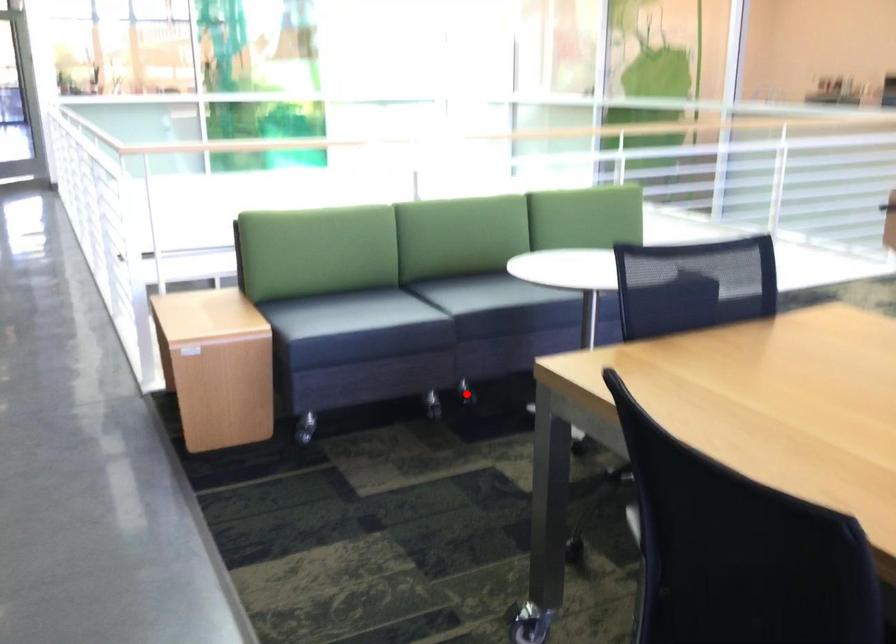
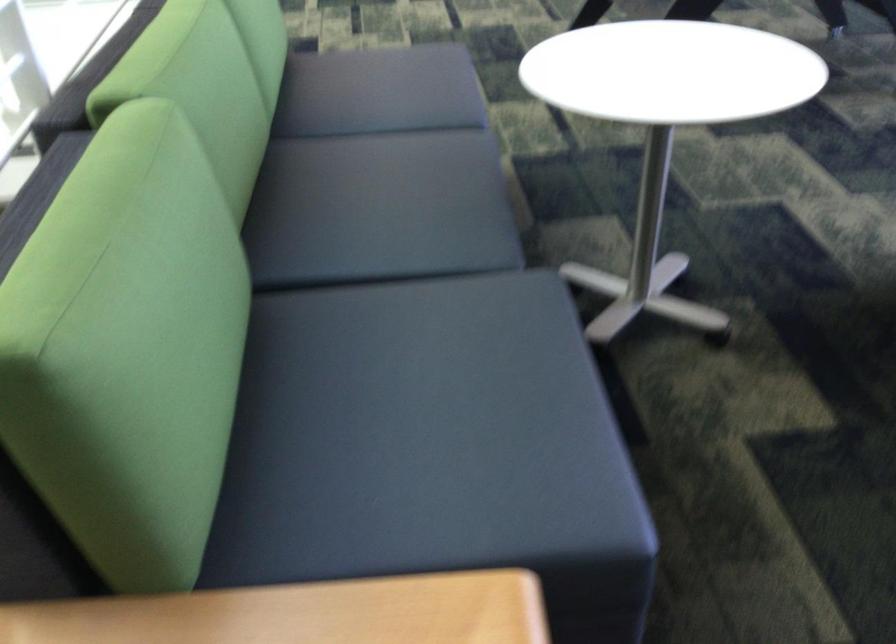
Question: I am providing you with two images of the same scene from different viewpoints. A red point is marked on the first image. At the location where the point appears in image 1, is it still visible in image 2?

Choices:
 (A) Yes
 (B) No

Answer: (B)